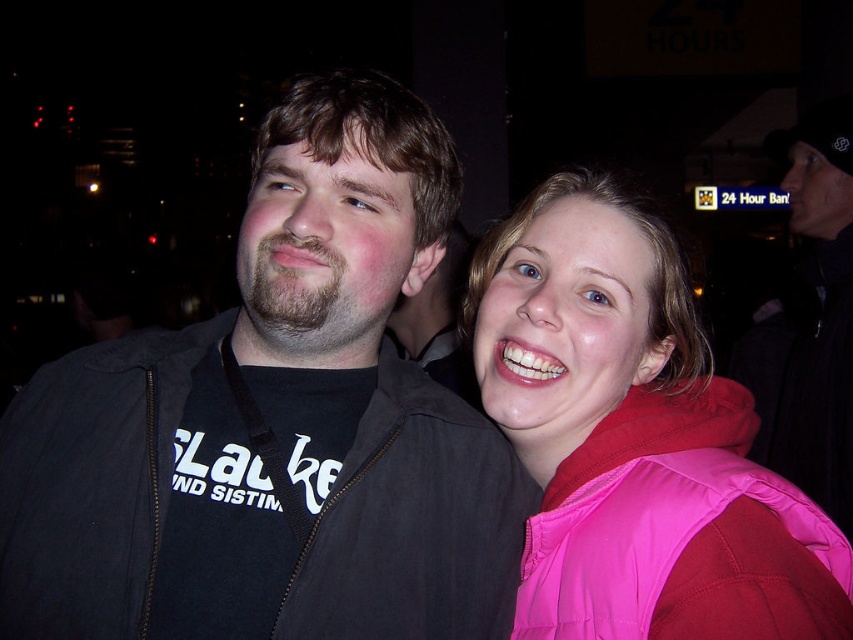
Measure the distance from black matte jacket at left to black jacket at right.

2.04 meters

Can you confirm if black matte jacket at left is positioned below black jacket at right?

Yes, black matte jacket at left is below black jacket at right.

Describe the element at coordinates (415, 524) in the screenshot. I see `black matte jacket at left` at that location.

At what (x,y) coordinates should I click in order to perform the action: click on black matte jacket at left. Please return your answer as a coordinate pair (x, y). Looking at the image, I should click on (415, 524).

Does pink fabric jacket at upper right have a smaller size compared to black matte jacket at left?

No, pink fabric jacket at upper right is not smaller than black matte jacket at left.

Where is `pink fabric jacket at upper right`? pink fabric jacket at upper right is located at coordinates (635, 440).

Does pink fabric jacket at upper right have a greater height compared to black jacket at right?

No, pink fabric jacket at upper right is not taller than black jacket at right.

Between pink fabric jacket at upper right and black jacket at right, which one has less height?

pink fabric jacket at upper right

At what (x,y) coordinates should I click in order to perform the action: click on pink fabric jacket at upper right. Please return your answer as a coordinate pair (x, y). Looking at the image, I should click on (635, 440).

Where is `pink fabric jacket at upper right`? pink fabric jacket at upper right is located at coordinates (635, 440).